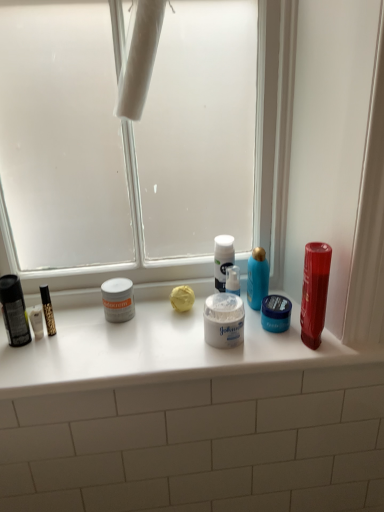
Question: From a real-world perspective, is white matte jar at center, positioned as the second toiletry in right-to-left order, below blue matte jar at center, the 2th toiletry viewed from the left?

Choices:
 (A) yes
 (B) no

Answer: (B)

Question: Is white matte jar at center, positioned as the second toiletry in right-to-left order, outside blue matte jar at center, which is the first toiletry in right-to-left order?

Choices:
 (A) yes
 (B) no

Answer: (A)

Question: Can you confirm if white matte jar at center, marked as the 1th toiletry in a left-to-right arrangement, is smaller than blue matte jar at center, which is the first toiletry in right-to-left order?

Choices:
 (A) no
 (B) yes

Answer: (A)

Question: Is white matte jar at center, marked as the 1th toiletry in a left-to-right arrangement, positioned with its back to blue matte jar at center, the 2th toiletry viewed from the left?

Choices:
 (A) no
 (B) yes

Answer: (A)

Question: Does white matte jar at center, positioned as the second toiletry in right-to-left order, contain blue matte jar at center, the 2th toiletry viewed from the left?

Choices:
 (A) no
 (B) yes

Answer: (A)

Question: From the image's perspective, does white matte jar at center, positioned as the second toiletry in right-to-left order, appear higher than blue matte jar at center, the 2th toiletry viewed from the left?

Choices:
 (A) yes
 (B) no

Answer: (A)

Question: Is transparent glass window screen at center wider than blue matte jar at center, which is the first toiletry in right-to-left order?

Choices:
 (A) no
 (B) yes

Answer: (B)

Question: Can you confirm if transparent glass window screen at center is thinner than blue matte jar at center, the 2th toiletry viewed from the left?

Choices:
 (A) yes
 (B) no

Answer: (B)

Question: Does transparent glass window screen at center have a larger size compared to blue matte jar at center, the 2th toiletry viewed from the left?

Choices:
 (A) no
 (B) yes

Answer: (B)

Question: From a real-world perspective, is transparent glass window screen at center positioned under blue matte jar at center, the 2th toiletry viewed from the left, based on gravity?

Choices:
 (A) no
 (B) yes

Answer: (A)

Question: Considering the relative sizes of transparent glass window screen at center and blue matte jar at center, which is the first toiletry in right-to-left order, in the image provided, is transparent glass window screen at center taller than blue matte jar at center, which is the first toiletry in right-to-left order,?

Choices:
 (A) yes
 (B) no

Answer: (A)

Question: Is transparent glass window screen at center at the left side of blue matte jar at center, which is the first toiletry in right-to-left order?

Choices:
 (A) no
 (B) yes

Answer: (B)

Question: Is white matte counter at center positioned behind shiny plastic mouthwash at right?

Choices:
 (A) no
 (B) yes

Answer: (A)